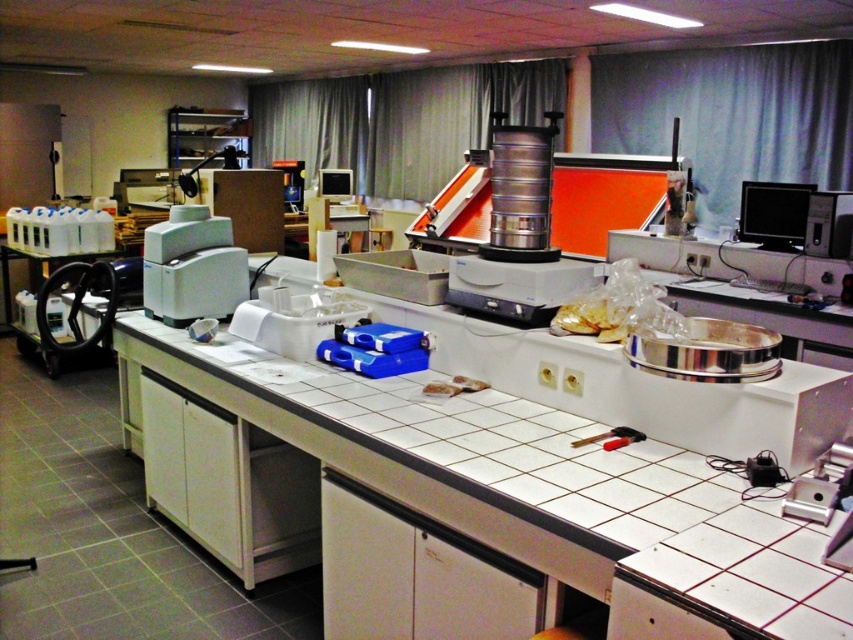
Question: Can you confirm if white tile countertop at center is smaller than matte black monitor at upper right?

Choices:
 (A) yes
 (B) no

Answer: (B)

Question: Which point is closer to the camera?

Choices:
 (A) (184, 237)
 (B) (627, 426)

Answer: (B)

Question: Which of the following is the closest to the observer?

Choices:
 (A) (329, 195)
 (B) (822, 198)

Answer: (B)

Question: Does matte black monitor at upper right appear over matte black monitor at center?

Choices:
 (A) yes
 (B) no

Answer: (B)

Question: Does white plastic printer at left come in front of matte black monitor at upper right?

Choices:
 (A) yes
 (B) no

Answer: (A)

Question: Which point is farther from the camera taking this photo?

Choices:
 (A) (608, 445)
 (B) (200, 304)
 (C) (824, 218)

Answer: (C)